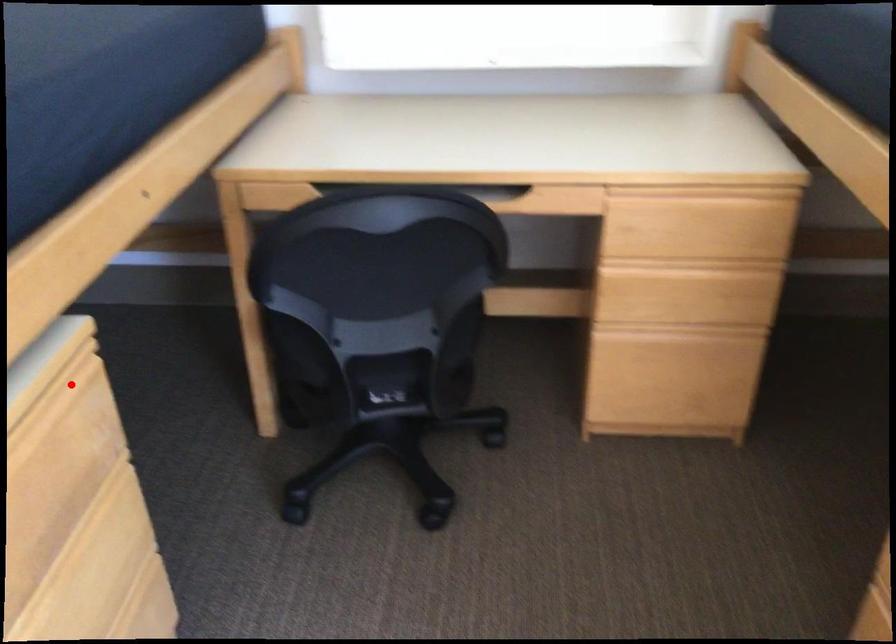
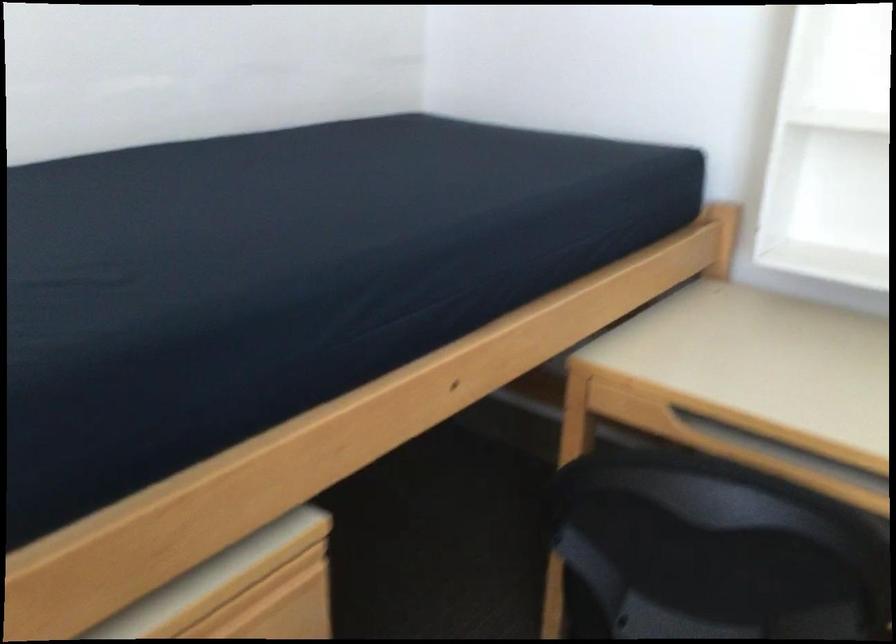
Question: I am providing you with two images of the same scene from different viewpoints. Given a red point in image1, look at the same physical point in image2. Is it:

Choices:
 (A) Closer to the viewpoint
 (B) Farther from the viewpoint

Answer: (A)